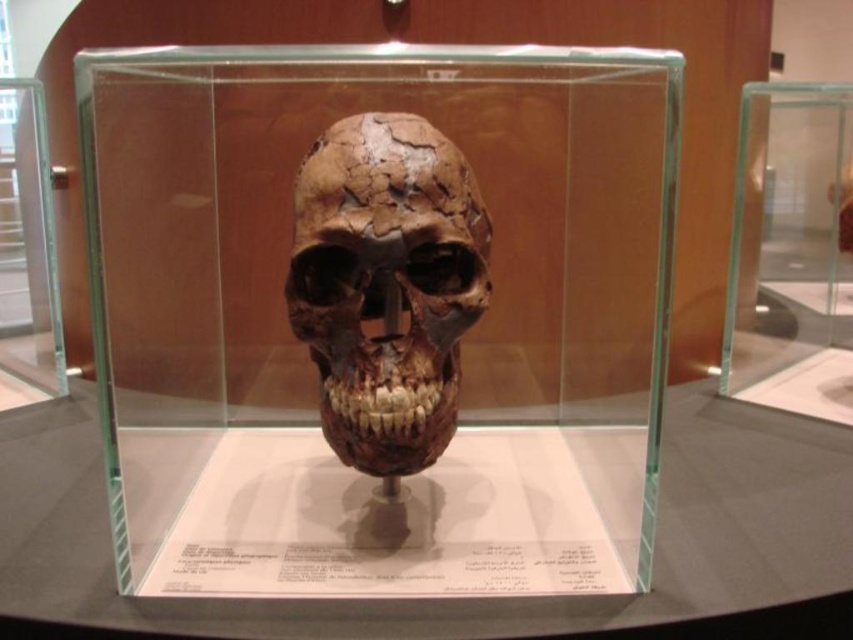
Is transparent glass skull at center smaller than brown cracked bone skull at center?

No, transparent glass skull at center is not smaller than brown cracked bone skull at center.

Does transparent glass skull at center lie behind brown cracked bone skull at center?

No, it is not.

Locate an element on the screen. The width and height of the screenshot is (853, 640). transparent glass skull at center is located at coordinates (380, 314).

Does transparent glass skull at center have a lesser width compared to transparent glass table at center?

Yes.

Is transparent glass skull at center to the right of transparent glass table at center from the viewer's perspective?

Incorrect, transparent glass skull at center is not on the right side of transparent glass table at center.

Where is `transparent glass skull at center`? transparent glass skull at center is located at coordinates (380, 314).

Where is `transparent glass skull at center`? This screenshot has width=853, height=640. transparent glass skull at center is located at coordinates (380, 314).

Between transparent glass table at center and brown cracked bone skull at center, which one has more height?

brown cracked bone skull at center

Is transparent glass table at center taller than brown cracked bone skull at center?

Incorrect, transparent glass table at center's height is not larger of brown cracked bone skull at center's.

Is point (33, 557) positioned after point (328, 308)?

Yes, it is behind point (328, 308).

The height and width of the screenshot is (640, 853). What are the coordinates of `transparent glass table at center` in the screenshot? It's located at (474, 600).